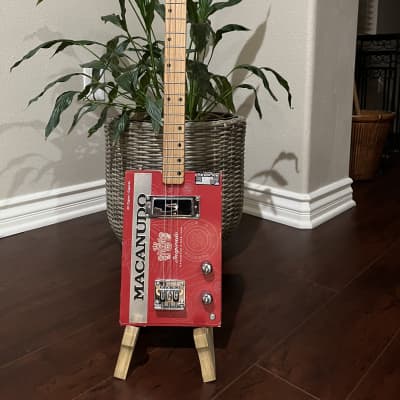
Locate an element on the screen. This screenshot has height=400, width=400. wall is located at coordinates (14, 166).